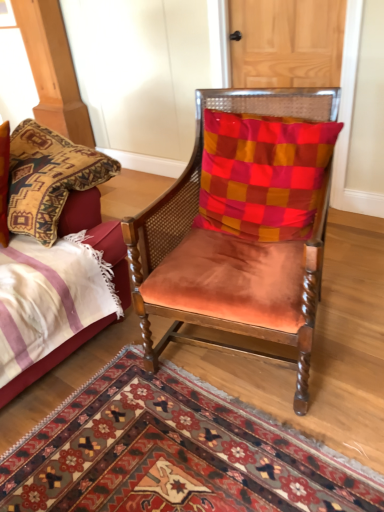
Locate an element on the screen. This screenshot has width=384, height=512. blank space above carpet with intricate patterns at center (from a real-world perspective) is located at coordinates (172, 450).